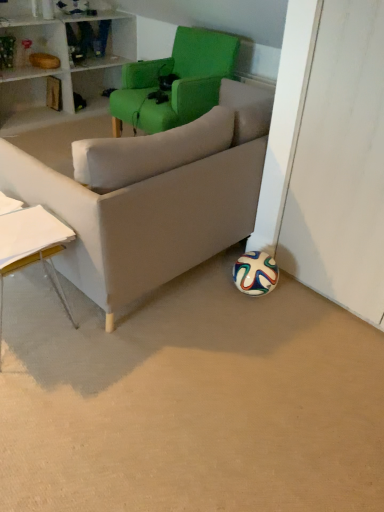
Question: Considering their positions, is white paper at left located in front of or behind green fabric chair at upper center?

Choices:
 (A) front
 (B) behind

Answer: (A)

Question: Is white paper at left spatially inside green fabric chair at upper center, or outside of it?

Choices:
 (A) outside
 (B) inside

Answer: (A)

Question: In terms of size, does white paper at left appear bigger or smaller than green fabric chair at upper center?

Choices:
 (A) big
 (B) small

Answer: (B)

Question: From the image's perspective, is green fabric chair at upper center located above or below white paper at left?

Choices:
 (A) below
 (B) above

Answer: (B)

Question: Choose the correct answer: Is green fabric chair at upper center inside white paper at left or outside it?

Choices:
 (A) outside
 (B) inside

Answer: (A)

Question: Is green fabric chair at upper center to the left or to the right of white paper at left in the image?

Choices:
 (A) right
 (B) left

Answer: (A)

Question: Looking at their shapes, would you say green fabric chair at upper center is wider or thinner than white paper at left?

Choices:
 (A) thin
 (B) wide

Answer: (B)